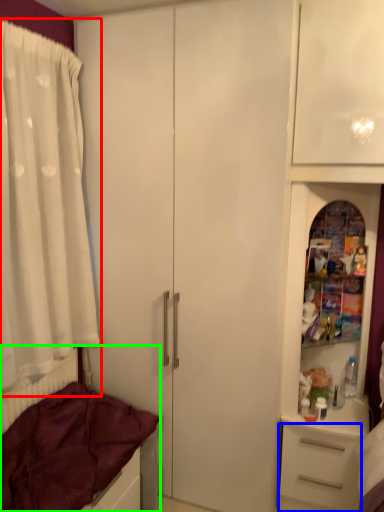
Question: Based on their relative distances, which object is nearer to curtain (highlighted by a red box)? Choose from drawer (highlighted by a blue box) and bed (highlighted by a green box).

Choices:
 (A) drawer
 (B) bed

Answer: (B)